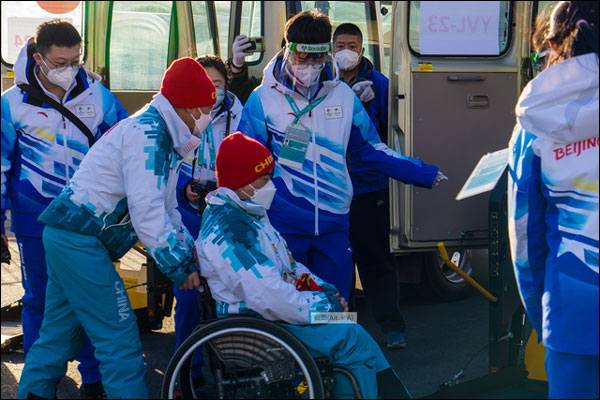
Where is `tire on wheelchair`? tire on wheelchair is located at coordinates (306, 361).